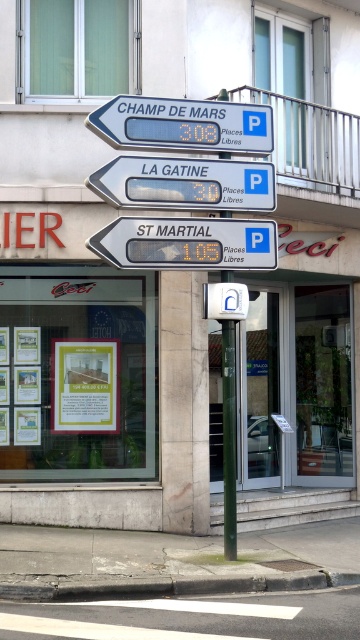
Who is taller, matte white sign at center or yellow paper at center?

yellow paper at center

Is point (240, 202) more distant than point (110, 424)?

No, it is in front of (110, 424).

Find the location of `matte white sign at center`. matte white sign at center is located at coordinates (186, 182).

Is matte gray sign at center positioned before green metallic pole at center?

Yes, it is in front of green metallic pole at center.

Does matte gray sign at center have a greater height compared to green metallic pole at center?

No.

You are a GUI agent. You are given a task and a screenshot of the screen. Output one action in this format:
    pyautogui.click(x=<x>, y=<y>)
    Task: Click on the matte gray sign at center
    This screenshot has height=640, width=360.
    Given the screenshot: What is the action you would take?
    pyautogui.click(x=187, y=243)

Which is in front, point (254, 196) or point (227, 548)?

Positioned in front is point (227, 548).

Can you confirm if matte white sign at center is smaller than green metallic pole at center?

No, matte white sign at center is not smaller than green metallic pole at center.

The image size is (360, 640). Find the location of `matte white sign at center`. matte white sign at center is located at coordinates (186, 182).